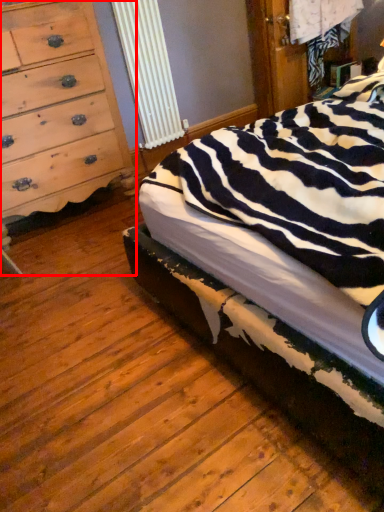
Question: Where is chest of drawers (annotated by the red box) located in relation to bed in the image?

Choices:
 (A) left
 (B) right

Answer: (A)